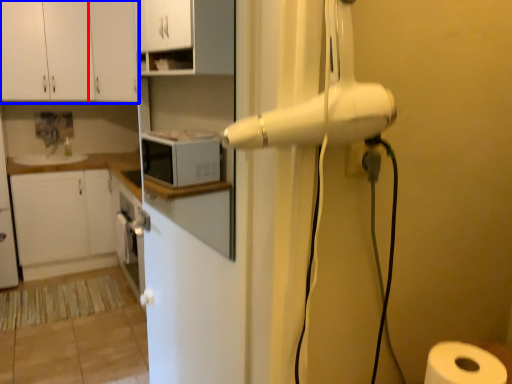
Question: Which object is further to the camera taking this photo, cabinetry (highlighted by a red box) or cabinetry (highlighted by a blue box)?

Choices:
 (A) cabinetry
 (B) cabinetry

Answer: (A)